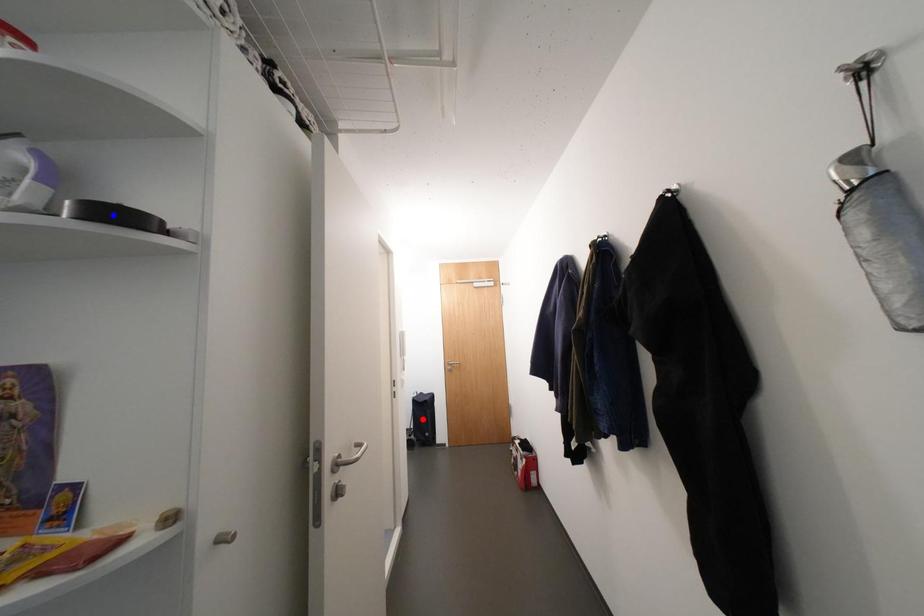
Question: In the image, two points are highlighted. Which point is nearer to the camera? Reply with the corresponding letter.

Choices:
 (A) blue point
 (B) red point

Answer: (A)